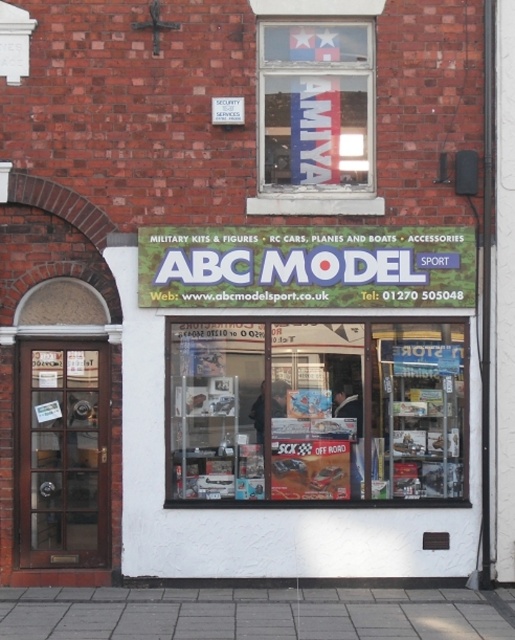
Question: Considering the real-world distances, which object is farthest from the matte plastic model kit at center?

Choices:
 (A) gray concrete pavement at lower center
 (B) white plastic sign at center

Answer: (A)

Question: Which object appears farthest from the camera in this image?

Choices:
 (A) white plastic sign at center
 (B) matte plastic model kit at center
 (C) gray concrete pavement at lower center

Answer: (B)

Question: Is matte plastic model kit at center smaller than white plastic sign at center?

Choices:
 (A) yes
 (B) no

Answer: (B)

Question: Which object is farther from the camera taking this photo?

Choices:
 (A) gray concrete pavement at lower center
 (B) white plastic sign at center

Answer: (B)

Question: Is matte plastic model kit at center closer to the viewer compared to white plastic sign at center?

Choices:
 (A) yes
 (B) no

Answer: (B)

Question: Can you confirm if matte plastic model kit at center is positioned to the right of gray concrete pavement at lower center?

Choices:
 (A) yes
 (B) no

Answer: (A)